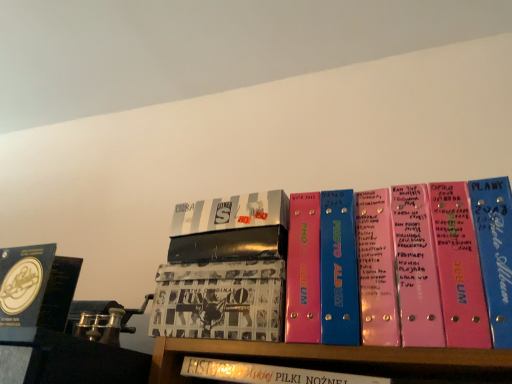
Question: Is printed paper album at center, arranged as the fourth book when viewed from the right, further to camera compared to white leather book at center, the 4th book from the left?

Choices:
 (A) no
 (B) yes

Answer: (B)

Question: Considering the relative sizes of printed paper album at center, arranged as the fourth book when viewed from the right, and white leather book at center, acting as the 2th book starting from the right, in the image provided, is printed paper album at center, arranged as the fourth book when viewed from the right, wider than white leather book at center, acting as the 2th book starting from the right,?

Choices:
 (A) no
 (B) yes

Answer: (A)

Question: Does printed paper album at center, arranged as the fourth book when viewed from the right, have a smaller size compared to white leather book at center, acting as the 2th book starting from the right?

Choices:
 (A) yes
 (B) no

Answer: (B)

Question: From the image's perspective, does printed paper album at center, arranged as the fourth book when viewed from the right, appear lower than white leather book at center, the 4th book from the left?

Choices:
 (A) yes
 (B) no

Answer: (B)

Question: Is white leather book at center, the 4th book from the left, surrounded by printed paper album at center, positioned as the second book in left-to-right order?

Choices:
 (A) yes
 (B) no

Answer: (B)

Question: Is printed paper album at center, positioned as the second book in left-to-right order, far away from white leather book at center, the 4th book from the left?

Choices:
 (A) yes
 (B) no

Answer: (B)

Question: From a real-world perspective, is metallic silver photo album at center, the third book positioned from the left, beneath white leather book at center, the 4th book from the left?

Choices:
 (A) no
 (B) yes

Answer: (A)

Question: From the image's perspective, is metallic silver photo album at center, the third book positioned from the left, located above white leather book at center, acting as the 2th book starting from the right?

Choices:
 (A) yes
 (B) no

Answer: (A)

Question: Can you confirm if metallic silver photo album at center, the third book positioned from the left, is shorter than white leather book at center, acting as the 2th book starting from the right?

Choices:
 (A) no
 (B) yes

Answer: (A)

Question: Can you confirm if metallic silver photo album at center, acting as the third book starting from the right, is wider than white leather book at center, acting as the 2th book starting from the right?

Choices:
 (A) no
 (B) yes

Answer: (A)

Question: Is the position of metallic silver photo album at center, acting as the third book starting from the right, more distant than that of white leather book at center, acting as the 2th book starting from the right?

Choices:
 (A) yes
 (B) no

Answer: (A)

Question: Is white leather book at center, acting as the 2th book starting from the right, a part of metallic silver photo album at center, the third book positioned from the left?

Choices:
 (A) no
 (B) yes

Answer: (A)

Question: Can you confirm if white leather book at center, acting as the 2th book starting from the right, is positioned to the right of pink plastic photo album at center, the 1th book viewed from the right?

Choices:
 (A) yes
 (B) no

Answer: (B)